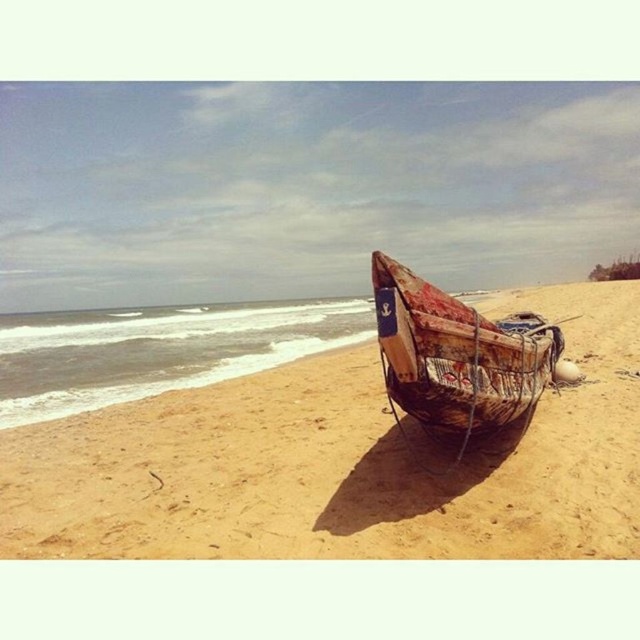
You are standing on the brown sandy beach at center and want to reach the rusty wooden boat at center. Which direction should you walk to get there?

You should walk to the left because the brown sandy beach at center is to the right of the rusty wooden boat at center, so moving left from the beach will lead you towards the boat.